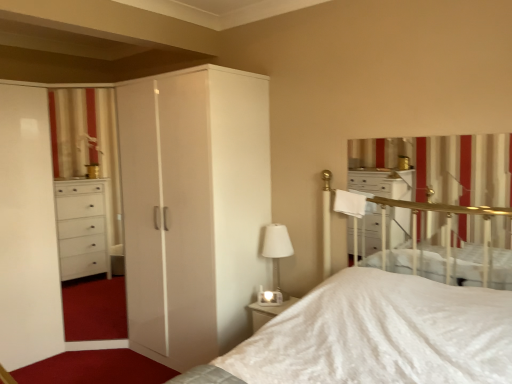
Question: Is white glass table lamp at center completely or partially inside white striped curtain at upper right?

Choices:
 (A) yes
 (B) no

Answer: (B)

Question: Can you confirm if white striped curtain at upper right is bigger than white glass table lamp at center?

Choices:
 (A) no
 (B) yes

Answer: (B)

Question: From a real-world perspective, is white striped curtain at upper right physically below white glass table lamp at center?

Choices:
 (A) yes
 (B) no

Answer: (B)

Question: From the image's perspective, would you say white striped curtain at upper right is shown under white glass table lamp at center?

Choices:
 (A) no
 (B) yes

Answer: (A)

Question: Is white striped curtain at upper right smaller than white glass table lamp at center?

Choices:
 (A) yes
 (B) no

Answer: (B)

Question: In terms of height, does white glossy wardrobe at center look taller or shorter compared to white striped curtain at upper right?

Choices:
 (A) short
 (B) tall

Answer: (B)

Question: From a real-world perspective, is white glossy wardrobe at center above or below white striped curtain at upper right?

Choices:
 (A) above
 (B) below

Answer: (B)

Question: From the image's perspective, is white glossy wardrobe at center located above or below white striped curtain at upper right?

Choices:
 (A) above
 (B) below

Answer: (B)

Question: Is point (194, 327) positioned closer to the camera than point (466, 225)?

Choices:
 (A) farther
 (B) closer

Answer: (B)

Question: Is white glass table lamp at center in front of or behind white glossy wardrobe at center in the image?

Choices:
 (A) front
 (B) behind

Answer: (B)

Question: Based on their positions, is white glass table lamp at center located to the left or right of white glossy wardrobe at center?

Choices:
 (A) left
 (B) right

Answer: (B)

Question: Is white glass table lamp at center inside the boundaries of white glossy wardrobe at center, or outside?

Choices:
 (A) inside
 (B) outside

Answer: (B)

Question: Looking at their shapes, would you say white glass table lamp at center is wider or thinner than white glossy wardrobe at center?

Choices:
 (A) thin
 (B) wide

Answer: (A)

Question: In terms of height, does white glass table lamp at center look taller or shorter compared to white striped curtain at upper right?

Choices:
 (A) tall
 (B) short

Answer: (B)

Question: Does point (278, 249) appear closer or farther from the camera than point (420, 226)?

Choices:
 (A) closer
 (B) farther

Answer: (B)